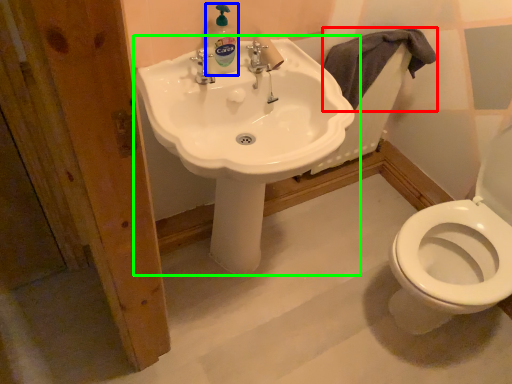
Question: Which is nearer to the bath towel (highlighted by a red box)? cleaning product (highlighted by a blue box) or sink (highlighted by a green box).

Choices:
 (A) cleaning product
 (B) sink

Answer: (B)